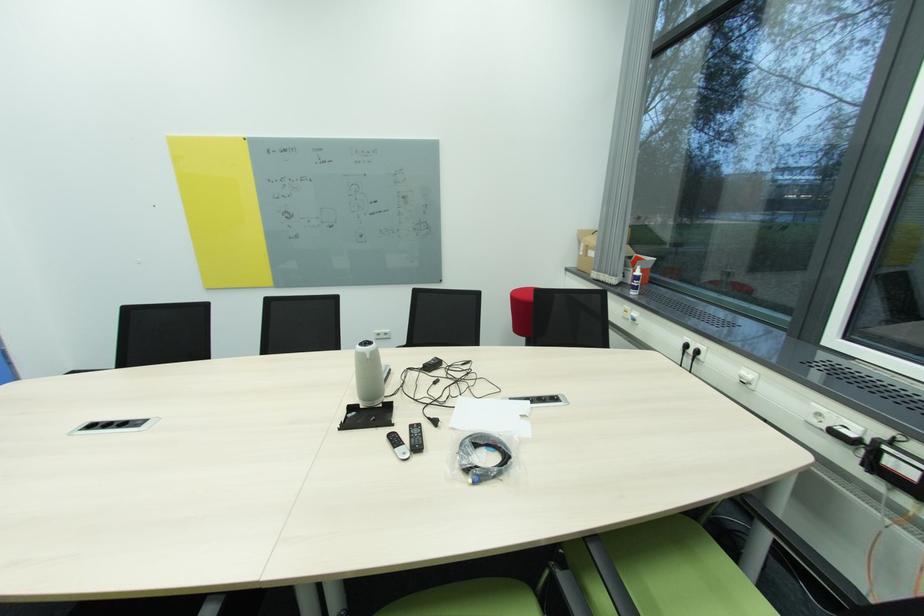
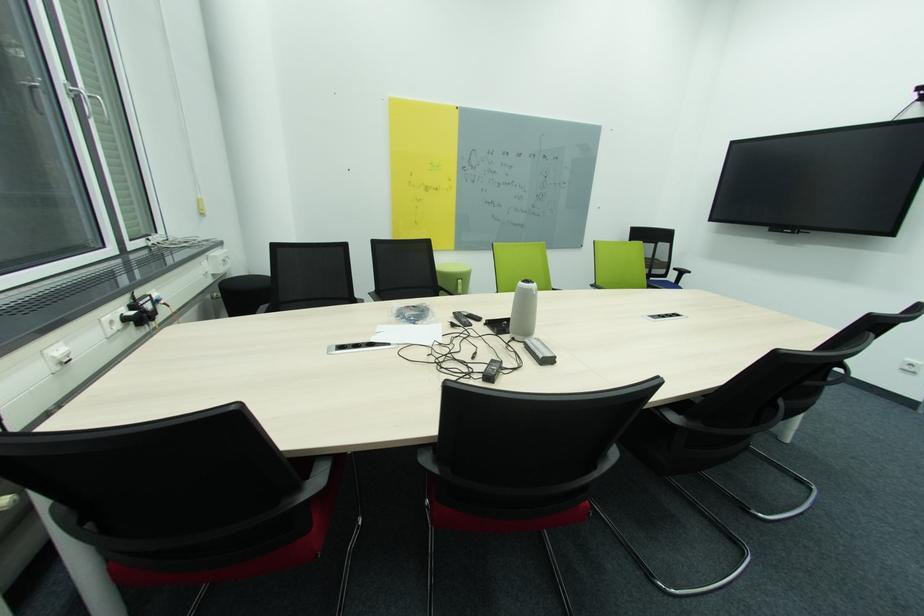
Question: I am providing you with two images of the same scene from different viewpoints. Please identify which objects are invisible in image2.

Choices:
 (A) green round stool
 (B) black chair armrest
 (C) white window handle
 (D) clear glass

Answer: (B)